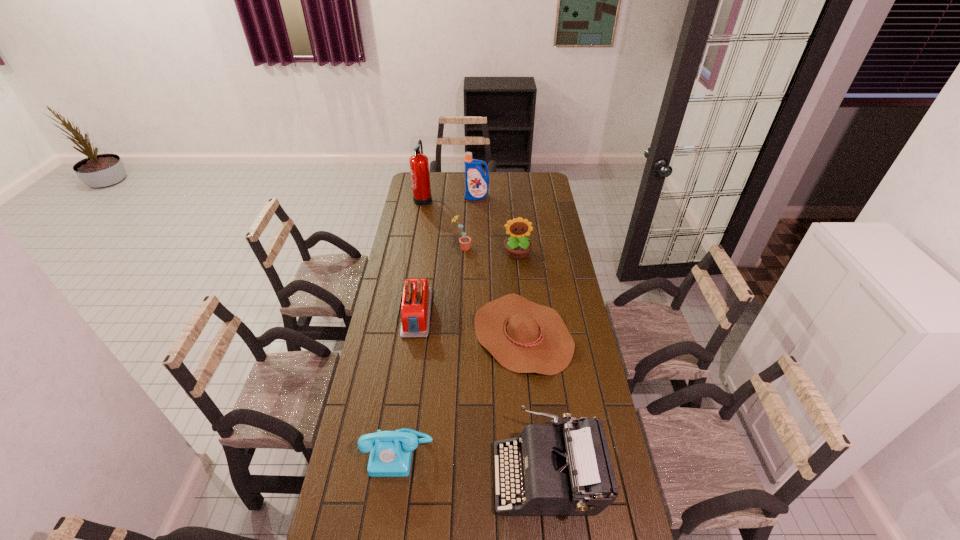
Locate an element on the screen. The image size is (960, 540). fire extinguisher is located at coordinates (419, 166).

This screenshot has width=960, height=540. What are the coordinates of `detergent` in the screenshot? It's located at (476, 182).

This screenshot has width=960, height=540. Identify the location of the right sunflower. (517, 246).

Identify the location of the left sunflower. (464, 241).

The image size is (960, 540). In order to click on toaster in this screenshot , I will do `click(416, 304)`.

Identify the location of typewriter. (571, 473).

This screenshot has width=960, height=540. I want to click on telephone, so click(390, 451).

Image resolution: width=960 pixels, height=540 pixels. What are the coordinates of `cowboy hat` in the screenshot? It's located at (524, 337).

At what (x,y) coordinates should I click in order to perform the action: click on vacant position located 0.340m on the front of the fire extinguisher. Please return your answer as a coordinate pair (x, y). This screenshot has height=540, width=960. Looking at the image, I should click on (415, 247).

At what (x,y) coordinates should I click in order to perform the action: click on vacant region located 0.160m on the label of the second tallest object. Please return your answer as a coordinate pair (x, y). Looking at the image, I should click on (476, 217).